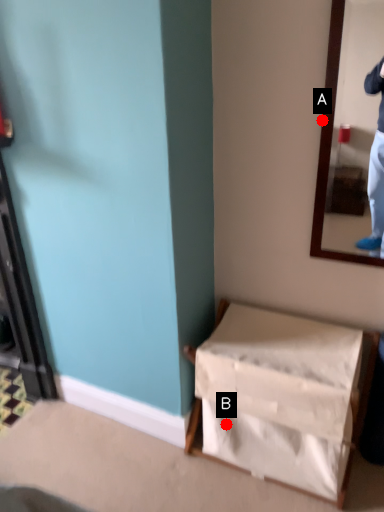
Question: Two points are circled on the image, labeled by A and B beside each circle. Among these points, which one is farthest from the camera?

Choices:
 (A) A is further
 (B) B is further

Answer: (B)